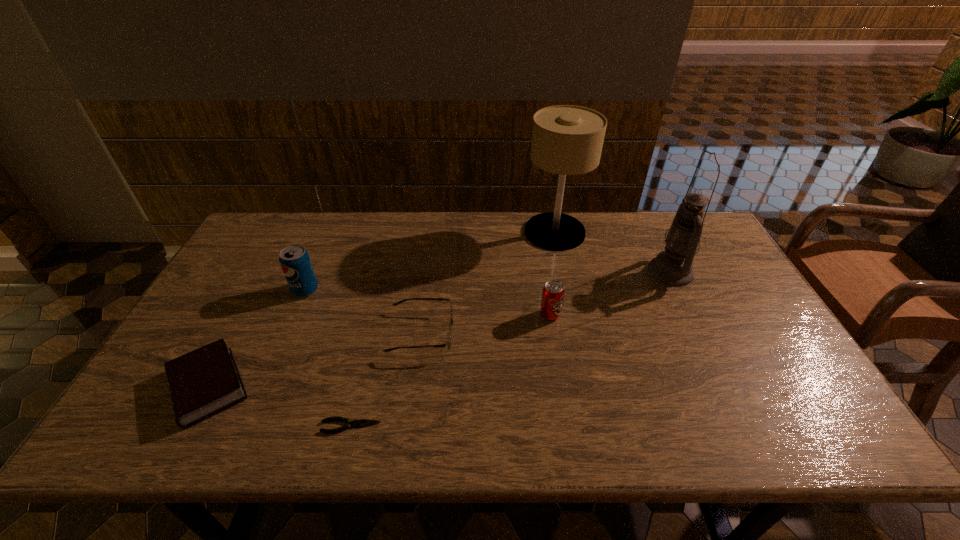
I want to click on blank region between the shortest object and the table lamp, so (x=453, y=329).

Locate an element on the screen. This screenshot has height=540, width=960. unoccupied area between the Bible and the taller soda is located at coordinates (257, 339).

Identify the location of empty location between the spectacles and the farther soda. (364, 312).

You are a GUI agent. You are given a task and a screenshot of the screen. Output one action in this format:
    pyautogui.click(x=<x>, y=<y>)
    Task: Click on the free space between the taller soda and the table lamp
    
    Given the screenshot: What is the action you would take?
    pyautogui.click(x=430, y=261)

Locate an element on the screen. This screenshot has height=540, width=960. free area in between the farthest object and the right soda is located at coordinates (552, 274).

Where is `free area in between the table lamp and the oil lamp`? The image size is (960, 540). free area in between the table lamp and the oil lamp is located at coordinates (612, 252).

You are a GUI agent. You are given a task and a screenshot of the screen. Output one action in this format:
    pyautogui.click(x=<x>, y=<y>)
    Task: Click on the object that is the second closest one to the spectacles
    The height and width of the screenshot is (540, 960).
    Given the screenshot: What is the action you would take?
    pyautogui.click(x=553, y=292)

Identify the location of object that is the fifth closest to the Bible. (566, 140).

Identify the location of vacant space that satisfies the following two spatial constraints: 1. on the front side of the fourth shortest object; 2. on the left side of the taller soda. The image size is (960, 540). (295, 315).